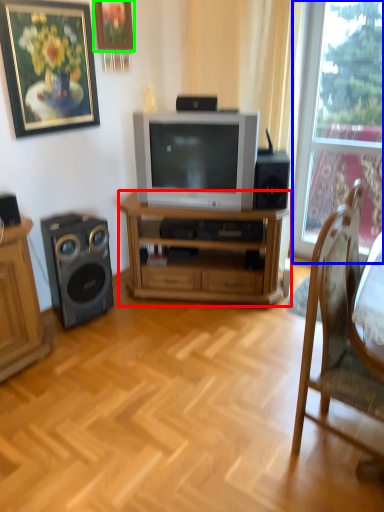
Question: Based on their relative distances, which object is farther from desk (highlighted by a red box)? Choose from window (highlighted by a blue box) and picture frame (highlighted by a green box).

Choices:
 (A) window
 (B) picture frame

Answer: (B)